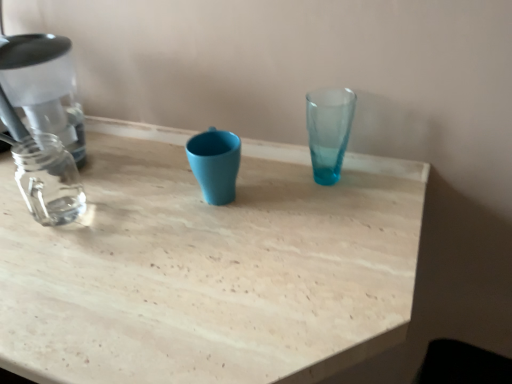
Measure the distance between point (335,157) and camera.

29.72 inches.

What do you see at coordinates (329, 130) in the screenshot? This screenshot has width=512, height=384. I see `translucent glass vase at upper center` at bounding box center [329, 130].

Locate an element on the screen. Image resolution: width=512 pixels, height=384 pixels. translucent glass vase at upper center is located at coordinates (329, 130).

Identify the location of light wood table at center. 209,266.

This screenshot has height=384, width=512. What do you see at coordinates (209, 266) in the screenshot? I see `light wood table at center` at bounding box center [209, 266].

Identify the location of translucent glass vase at upper center. (329, 130).

Does translucent glass vase at upper center appear on the left side of light wood table at center?

In fact, translucent glass vase at upper center is to the right of light wood table at center.

Considering the positions of objects translucent glass vase at upper center and light wood table at center in the image provided, who is in front, translucent glass vase at upper center or light wood table at center?

light wood table at center.

Between point (327, 123) and point (262, 317), which one is positioned in front?

The point (262, 317) is closer to the camera.

From the image's perspective, is translucent glass vase at upper center over light wood table at center?

Correct, translucent glass vase at upper center appears higher than light wood table at center in the image.

From a real-world perspective, is translucent glass vase at upper center below light wood table at center?

No, from a real-world perspective, translucent glass vase at upper center is not under light wood table at center.

Is translucent glass vase at upper center wider or thinner than light wood table at center?

Clearly, translucent glass vase at upper center has less width compared to light wood table at center.

Does translucent glass vase at upper center have a lesser height compared to light wood table at center?

Yes, translucent glass vase at upper center is shorter than light wood table at center.

Considering the sizes of objects translucent glass vase at upper center and light wood table at center in the image provided, who is bigger, translucent glass vase at upper center or light wood table at center?

Bigger between the two is light wood table at center.

Based on the photo, do you think translucent glass vase at upper center is within light wood table at center, or outside of it?

The correct answer is: outside.

Is translucent glass vase at upper center touching light wood table at center?

No.

From the picture: Is light wood table at center at the back of translucent glass vase at upper center?

translucent glass vase at upper center is not turned away from light wood table at center.

How many degrees apart are the facing directions of translucent glass vase at upper center and light wood table at center?

168 degrees separate the facing orientations of translucent glass vase at upper center and light wood table at center.

Find the location of a particular element. This screenshot has width=512, height=384. vase lying on the right of light wood table at center is located at coordinates (329, 130).

Can you confirm if light wood table at center is positioned to the right of translucent glass vase at upper center?

No, light wood table at center is not to the right of translucent glass vase at upper center.

Based on the photo, is the position of light wood table at center less distant than that of translucent glass vase at upper center?

That is True.

Between point (159, 225) and point (319, 107), which one is positioned behind?

The point (319, 107) is more distant.

From the image's perspective, is light wood table at center positioned above or below translucent glass vase at upper center?

Based on their image positions, light wood table at center is located beneath translucent glass vase at upper center.

From a real-world perspective, is light wood table at center positioned above or below translucent glass vase at upper center?

Clearly, from a real-world perspective, light wood table at center is below translucent glass vase at upper center.

In the scene shown: Does light wood table at center have a lesser width compared to translucent glass vase at upper center?

Incorrect, the width of light wood table at center is not less than that of translucent glass vase at upper center.

Considering the sizes of light wood table at center and translucent glass vase at upper center in the image, is light wood table at center taller or shorter than translucent glass vase at upper center?

Considering their sizes, light wood table at center has more height than translucent glass vase at upper center.

Can you confirm if light wood table at center is smaller than translucent glass vase at upper center?

Actually, light wood table at center might be larger than translucent glass vase at upper center.

In the scene shown: Would you say light wood table at center is inside or outside translucent glass vase at upper center?

light wood table at center cannot be found inside translucent glass vase at upper center.

Is light wood table at center positioned far away from translucent glass vase at upper center?

No, light wood table at center is not far from translucent glass vase at upper center.

Is light wood table at center oriented towards translucent glass vase at upper center?

Yes, light wood table at center is turned towards translucent glass vase at upper center.

The width and height of the screenshot is (512, 384). In order to click on table below the translucent glass vase at upper center (from the image's perspective) in this screenshot , I will do tap(209, 266).

Find the location of a particular element. vase located above the light wood table at center (from a real-world perspective) is located at coordinates (329, 130).

Where is `table in front of the translucent glass vase at upper center`? The width and height of the screenshot is (512, 384). table in front of the translucent glass vase at upper center is located at coordinates (209, 266).